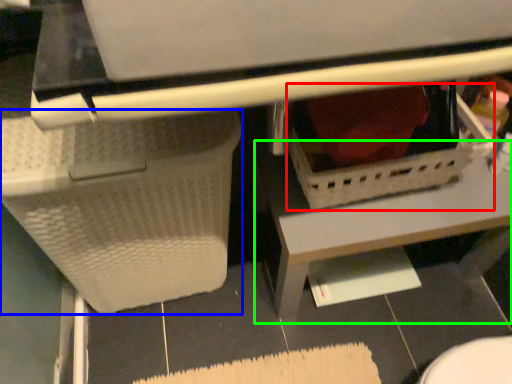
Question: Which is farther away from basket (highlighted by a red box)? basket (highlighted by a blue box) or table (highlighted by a green box)?

Choices:
 (A) basket
 (B) table

Answer: (A)